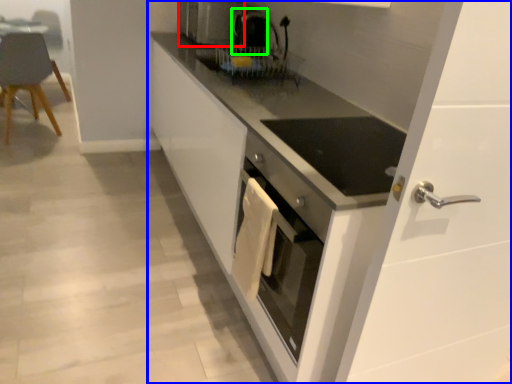
Question: Which object is positioned closest to home appliance (highlighted by a red box)? Select from cabinetry (highlighted by a blue box) and coffee machine (highlighted by a green box).

Choices:
 (A) cabinetry
 (B) coffee machine

Answer: (B)